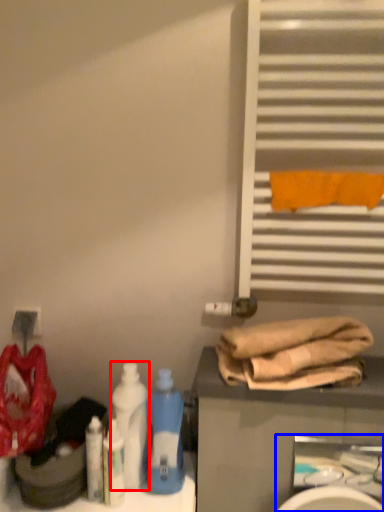
Question: Which object is further to the camera taking this photo, bottle (highlighted by a red box) or sink (highlighted by a blue box)?

Choices:
 (A) bottle
 (B) sink

Answer: (A)